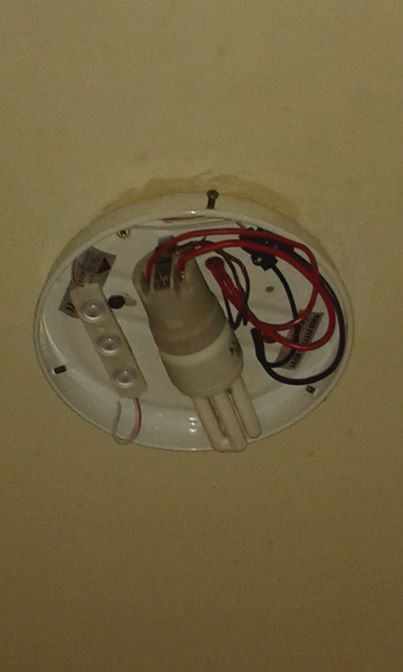
This screenshot has width=403, height=672. In order to click on white paint in this screenshot , I will do `click(88, 167)`.